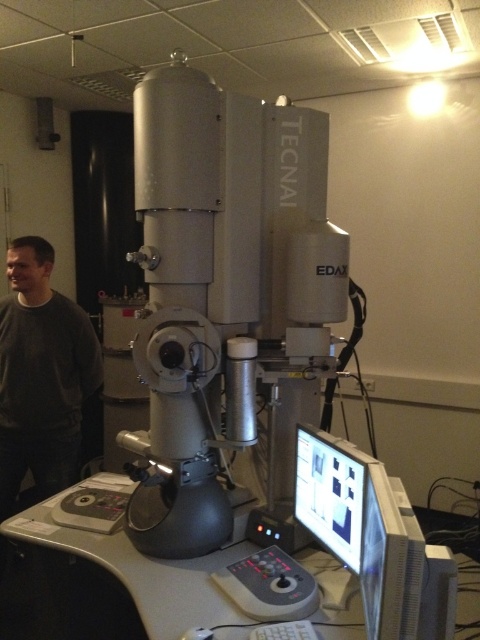
Is gray plastic table at lower center taller than dark gray sweater at left?

In fact, gray plastic table at lower center may be shorter than dark gray sweater at left.

Does gray plastic table at lower center appear over dark gray sweater at left?

No.

Is point (87, 556) positioned after point (35, 326)?

No.

Where is `gray plastic table at lower center`? gray plastic table at lower center is located at coordinates (108, 586).

Which is above, gray plastic table at lower center or white plastic monitor at lower right?

Positioned higher is white plastic monitor at lower right.

Can you confirm if gray plastic table at lower center is smaller than white plastic monitor at lower right?

Actually, gray plastic table at lower center might be larger than white plastic monitor at lower right.

Which is behind, point (96, 605) or point (376, 616)?

Point (96, 605)

This screenshot has width=480, height=640. I want to click on gray plastic table at lower center, so click(108, 586).

Between white plastic monitor at lower right and dark gray sweater at left, which one appears on the left side from the viewer's perspective?

dark gray sweater at left

Locate an element on the screen. Image resolution: width=480 pixels, height=640 pixels. white plastic monitor at lower right is located at coordinates (374, 538).

Find the location of a particular element. The width and height of the screenshot is (480, 640). white plastic monitor at lower right is located at coordinates pos(374,538).